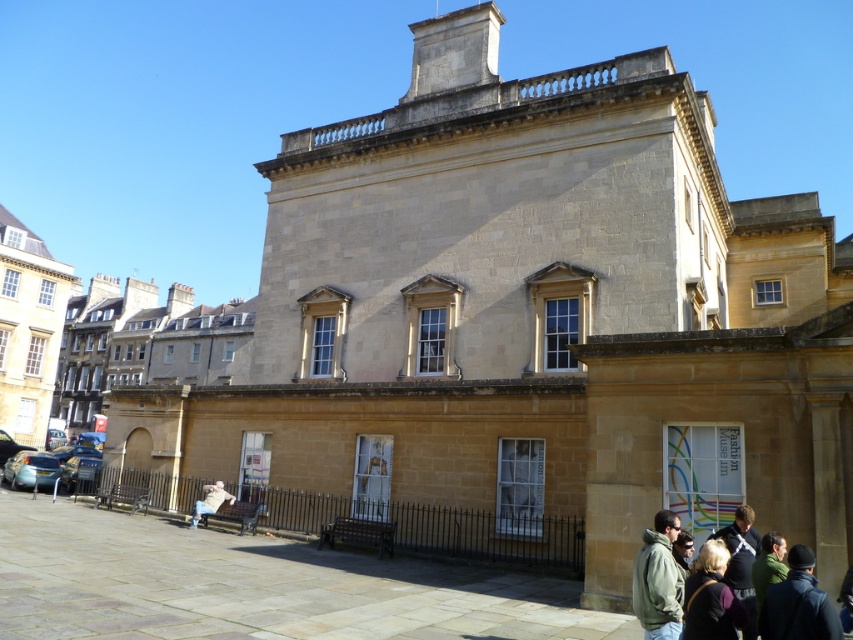
You are standing in front of the historic building and see the dark brown leather jacket at lower right and the light brown fabric bench at lower left. Which object is positioned to the right of the other?

The dark brown leather jacket at lower right is to the right of the light brown fabric bench at lower left.

You are standing at the center of the paved area in front of the historic building. You want to pick up the dark brown leather jacket at lower right. In which direction should you walk to reach it?

The dark brown leather jacket at lower right is located at point 0.934 on the x and y axis, so you should walk towards the lower right direction to reach it.